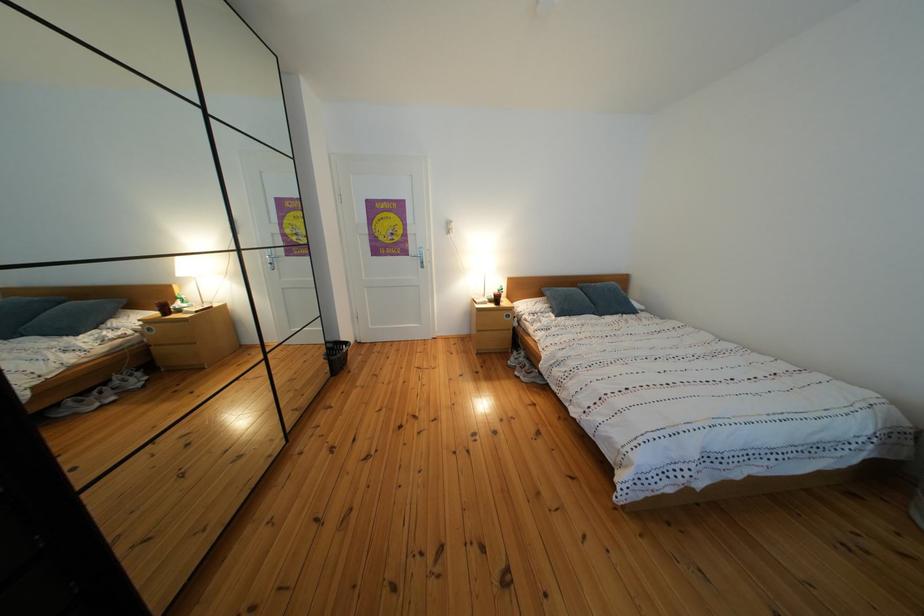
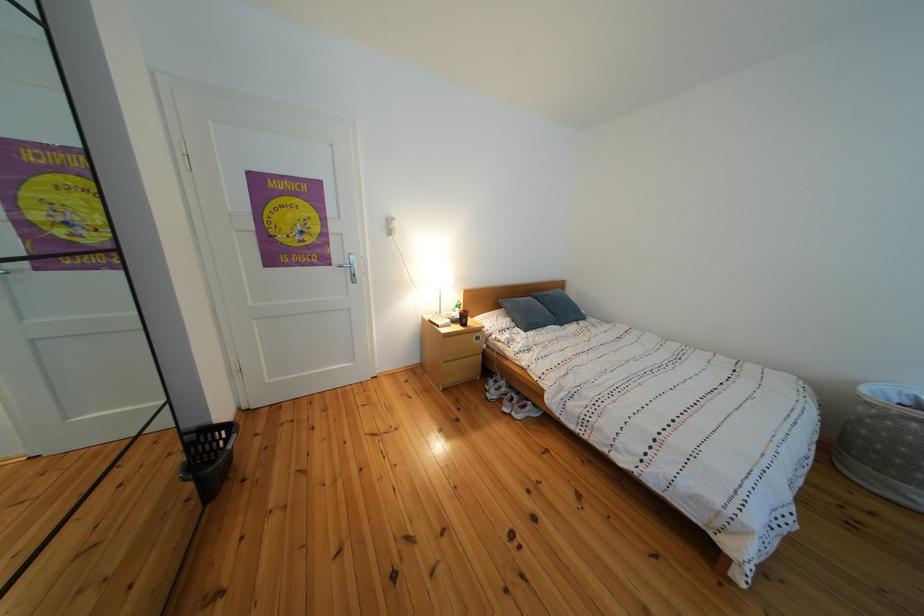
Where in the second image is the point corresponding to (597,290) from the first image?

(552, 300)